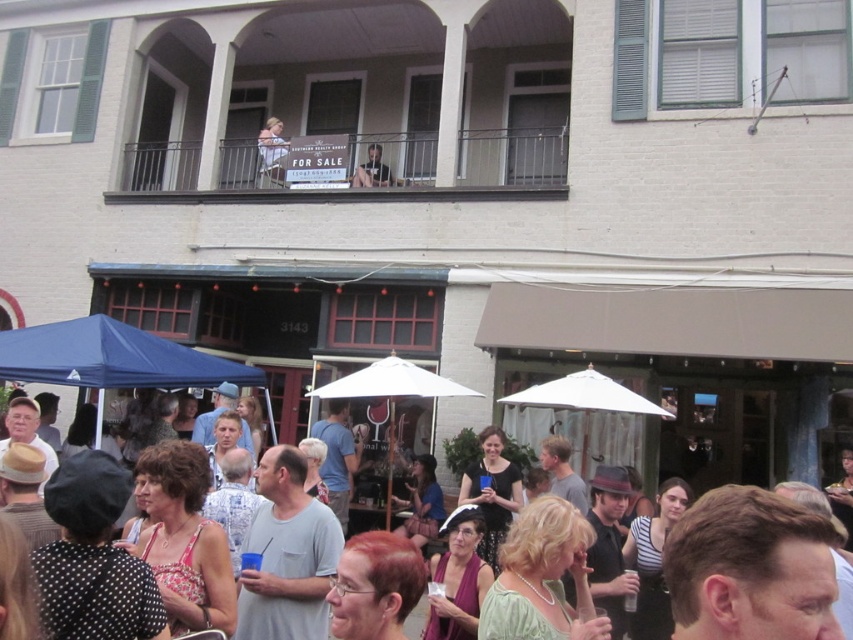
You are a photographer standing in front of the building. You want to take a photo that includes both the metallic railing at upper center and the smooth skin face at upper center. Based on their positions, which object should you adjust your camera to focus on first to ensure both are in the frame?

The smooth skin face at upper center should be focused on first because the metallic railing at upper center is to the right of it. By centering the face, you can then adjust the camera to include the railing to the right without losing the face from the frame.

Based on the photo, you are a delivery person with a box that is 1.5 meters wide. You need to pass between the metallic railing at upper center and the dark gray shirt at upper center. Can you fit through the space without tilting the box?

The metallic railing at upper center and dark gray shirt at upper center are 1.63 meters apart. Since your box is 1.5 meters wide, you can fit through the space without tilting it as there is enough clearance.

You are a photographer aiming to capture a clear shot of both the metallic railing at upper center and the smooth skin face at upper center in the scene. Considering their sizes, which object should you focus on first to ensure both are in frame without cropping?

The metallic railing at upper center is larger than the smooth skin face at upper center. To ensure both are in frame without cropping, focus on the larger metallic railing at upper center first, then adjust the framing to include the smaller smooth skin face at upper center.